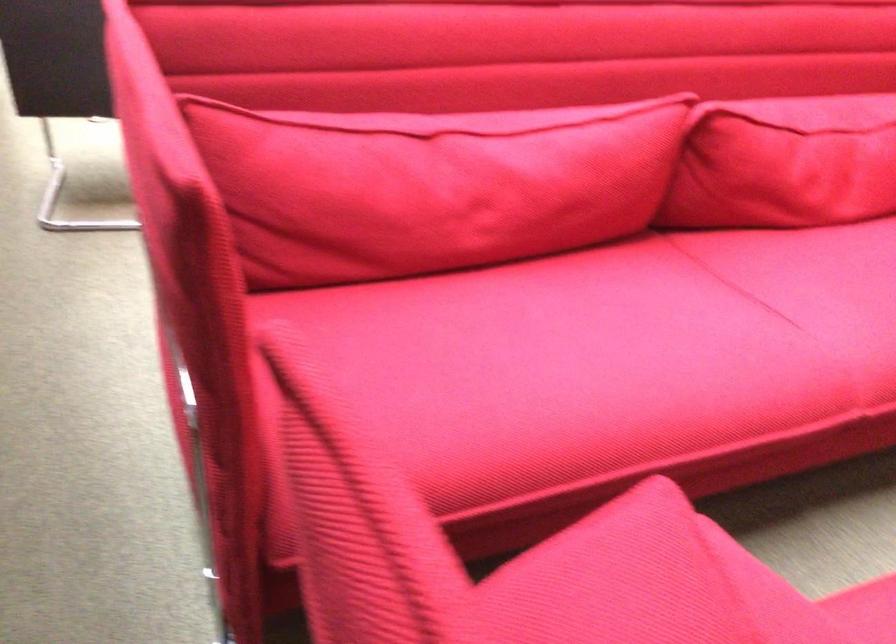
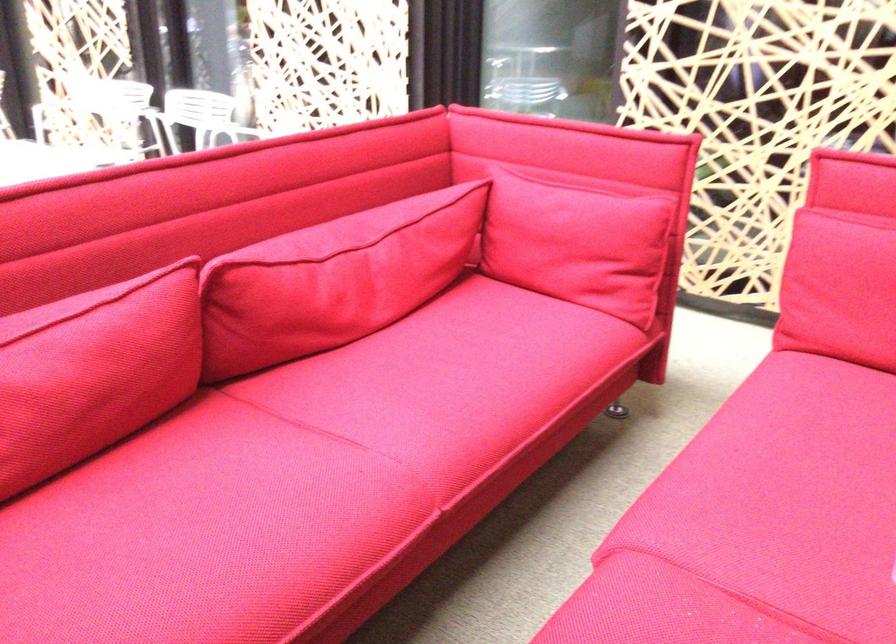
Find the pixel in the second image that matches the point at 712,323 in the first image.

(298, 476)